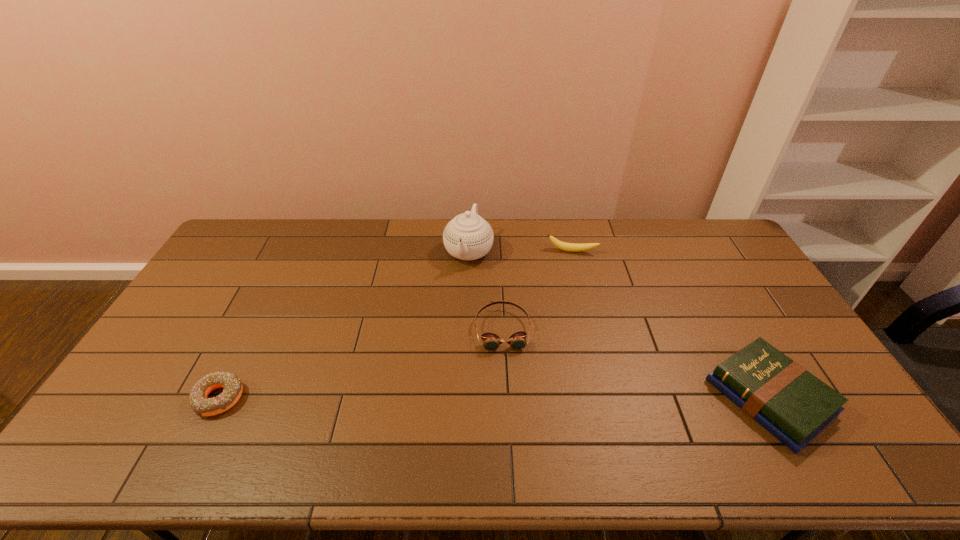
I want to click on vacant space on the desktop that is between the leftmost object and the rightmost object and is positioned through the lenses of the goggles, so click(510, 397).

This screenshot has width=960, height=540. Find the location of `free space on the desktop that is between the doughnut and the rightmost object and is positioned on the upward curve of the fourth object from left to right`. free space on the desktop that is between the doughnut and the rightmost object and is positioned on the upward curve of the fourth object from left to right is located at coordinates (562, 397).

Locate an element on the screen. The image size is (960, 540). free space on the desktop that is between the doughnut and the book and is positioned on the spout of the tallest object is located at coordinates (415, 398).